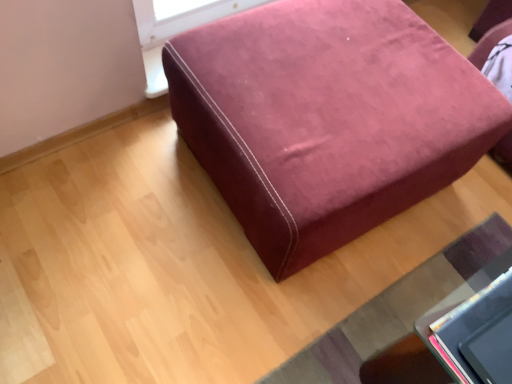
Locate an element on the screen. This screenshot has height=384, width=512. empty space that is ontop of velvet-like burgundy ottoman at lower right is located at coordinates (410, 310).